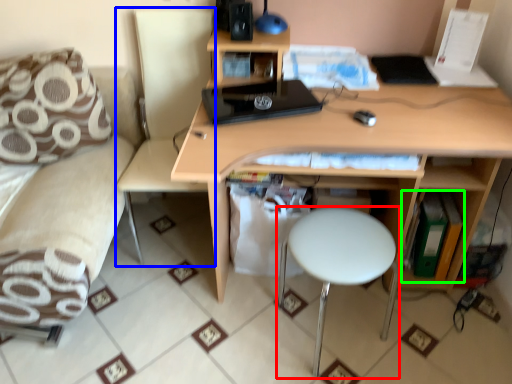
Question: Which object is positioned closest to stool (highlighted by a red box)? Select from swivel chair (highlighted by a blue box) and book (highlighted by a green box).

Choices:
 (A) swivel chair
 (B) book

Answer: (B)